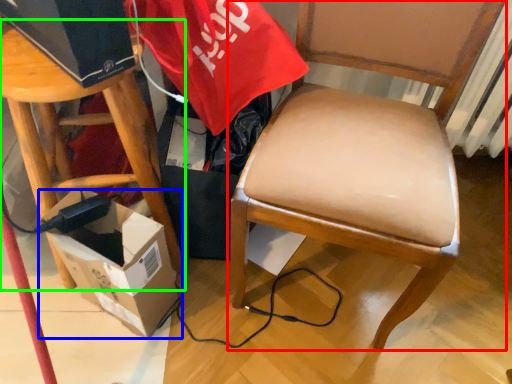
Question: Estimate the real-world distances between objects in this image. Which object is farther from chair (highlighted by a red box), box (highlighted by a blue box) or stool (highlighted by a green box)?

Choices:
 (A) box
 (B) stool

Answer: (B)